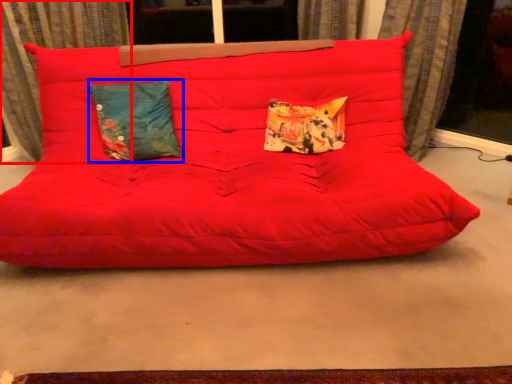
Question: Among these objects, which one is nearest to the camera, curtain (highlighted by a red box) or pillow (highlighted by a blue box)?

Choices:
 (A) curtain
 (B) pillow

Answer: (B)